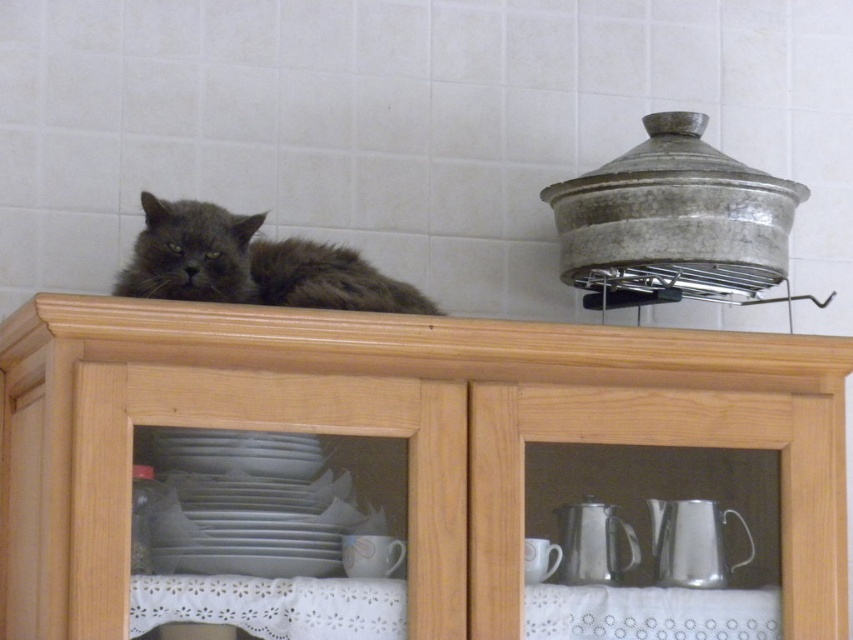
Does wooden cabinet at center come in front of fuzzy gray cat at upper center?

Yes.

The image size is (853, 640). Describe the element at coordinates (393, 435) in the screenshot. I see `wooden cabinet at center` at that location.

This screenshot has width=853, height=640. I want to click on wooden cabinet at center, so click(393, 435).

Consider the image. Is wooden cabinet at center behind silver metallic teapot at lower right?

No, it is not.

Looking at this image, who is more forward, (677, 394) or (657, 570)?

Positioned in front is point (677, 394).

Does point (103, 563) come farther from viewer compared to point (653, 547)?

No, (103, 563) is closer to viewer.

Identify the location of wooden cabinet at center. The width and height of the screenshot is (853, 640). (393, 435).

Does wooden cabinet at center have a lesser width compared to brushed metal tea pot at lower center?

No, wooden cabinet at center is not thinner than brushed metal tea pot at lower center.

Who is shorter, wooden cabinet at center or brushed metal tea pot at lower center?

With less height is brushed metal tea pot at lower center.

The width and height of the screenshot is (853, 640). What do you see at coordinates (393, 435) in the screenshot? I see `wooden cabinet at center` at bounding box center [393, 435].

The height and width of the screenshot is (640, 853). I want to click on wooden cabinet at center, so click(x=393, y=435).